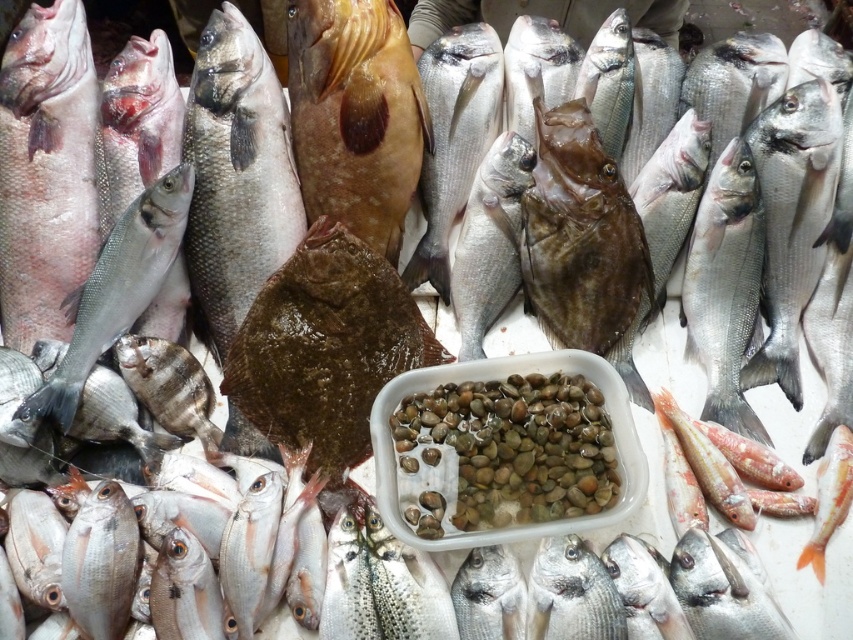
You are a customer at the fish market and want to buy a fish that is wider than the other. Which one should you choose between the matte pinkish fish at left and the silver metallic fish at right?

The matte pinkish fish at left is wider than the silver metallic fish at right, so you should choose the matte pinkish fish at left.

You are a fishmonger who needs to place a 12 inch ruler between the matte pinkish fish at left and the brown textured fish at center. Will the ruler exactly fit the space between them?

The distance between the matte pinkish fish at left and the brown textured fish at center is 12.64 inches, so the 12 inch ruler will fit with some space remaining.